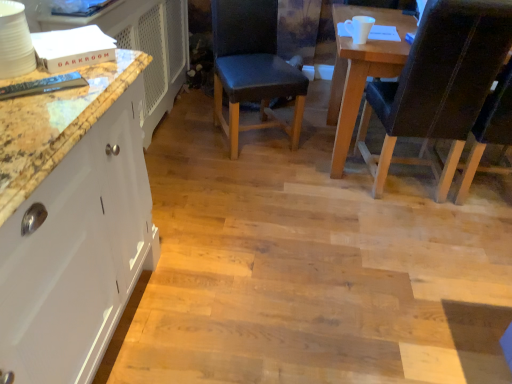
Question: Are leather-like black chair at right, positioned as the 1th chair in right-to-left order, and dark blue leather chair at center, acting as the first chair starting from the left, located far from each other?

Choices:
 (A) yes
 (B) no

Answer: (B)

Question: From a real-world perspective, is leather-like black chair at right, positioned as the 1th chair in right-to-left order, located higher than dark blue leather chair at center, acting as the first chair starting from the left?

Choices:
 (A) no
 (B) yes

Answer: (B)

Question: Could you tell me if leather-like black chair at right, marked as the 2th chair in a left-to-right arrangement, is facing dark blue leather chair at center, acting as the first chair starting from the left?

Choices:
 (A) yes
 (B) no

Answer: (B)

Question: Can you confirm if leather-like black chair at right, positioned as the 1th chair in right-to-left order, is thinner than dark blue leather chair at center, acting as the first chair starting from the left?

Choices:
 (A) no
 (B) yes

Answer: (A)

Question: Is leather-like black chair at right, positioned as the 1th chair in right-to-left order, smaller than dark blue leather chair at center, acting as the first chair starting from the left?

Choices:
 (A) no
 (B) yes

Answer: (A)

Question: Can you confirm if leather-like black chair at right, positioned as the 1th chair in right-to-left order, is wider than dark blue leather chair at center, acting as the first chair starting from the left?

Choices:
 (A) yes
 (B) no

Answer: (A)

Question: Is dark blue leather chair at center, acting as the first chair starting from the left, taller than leather-like black chair at right, positioned as the 1th chair in right-to-left order?

Choices:
 (A) yes
 (B) no

Answer: (B)

Question: Is leather-like black chair at right, marked as the 2th chair in a left-to-right arrangement, surrounded by dark blue leather chair at center, the second chair when ordered from right to left?

Choices:
 (A) no
 (B) yes

Answer: (A)

Question: Would you say dark blue leather chair at center, the second chair when ordered from right to left, is outside leather-like black chair at right, marked as the 2th chair in a left-to-right arrangement?

Choices:
 (A) yes
 (B) no

Answer: (A)

Question: Can you confirm if dark blue leather chair at center, acting as the first chair starting from the left, is smaller than leather-like black chair at right, positioned as the 1th chair in right-to-left order?

Choices:
 (A) yes
 (B) no

Answer: (A)

Question: Is dark blue leather chair at center, acting as the first chair starting from the left, shorter than leather-like black chair at right, positioned as the 1th chair in right-to-left order?

Choices:
 (A) no
 (B) yes

Answer: (B)

Question: From a real-world perspective, is dark blue leather chair at center, the second chair when ordered from right to left, positioned under leather-like black chair at right, positioned as the 1th chair in right-to-left order, based on gravity?

Choices:
 (A) yes
 (B) no

Answer: (A)

Question: In terms of width, does leather-like black chair at right, positioned as the 1th chair in right-to-left order, look wider or thinner when compared to dark blue leather chair at center, the second chair when ordered from right to left?

Choices:
 (A) wide
 (B) thin

Answer: (A)